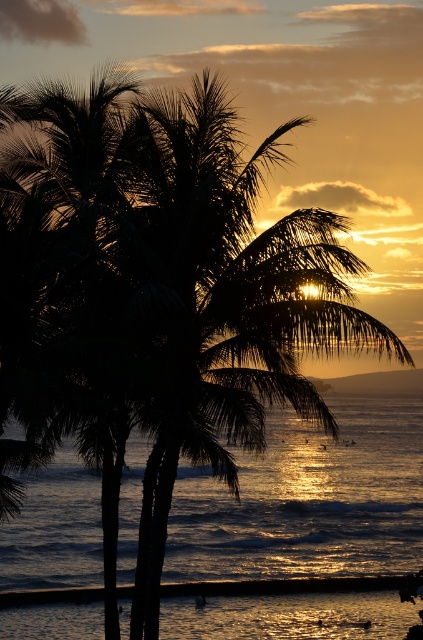
You are standing at the center of the image and want to find the shiny golden water at center. According to the coordinates provided, in which direction should you look to locate it?

The shiny golden water at center is located at coordinates point (x=307, y=500). Since you are at the center, you should look towards the lower right direction to find it.

You are standing on the beach looking at the sunset. You see the shiny golden water at center and the smooth sand at lower center. Which of these two features is located to the right of the other?

The shiny golden water at center is positioned on the right side of smooth sand at lower center.

You are standing on the beach looking at the sunset. You see the shiny golden water at center and the smooth sand at lower center. Which object is closer to your feet?

The smooth sand at lower center is closer to your feet because it is positioned lower in the scene than the shiny golden water at center, which is located above it.